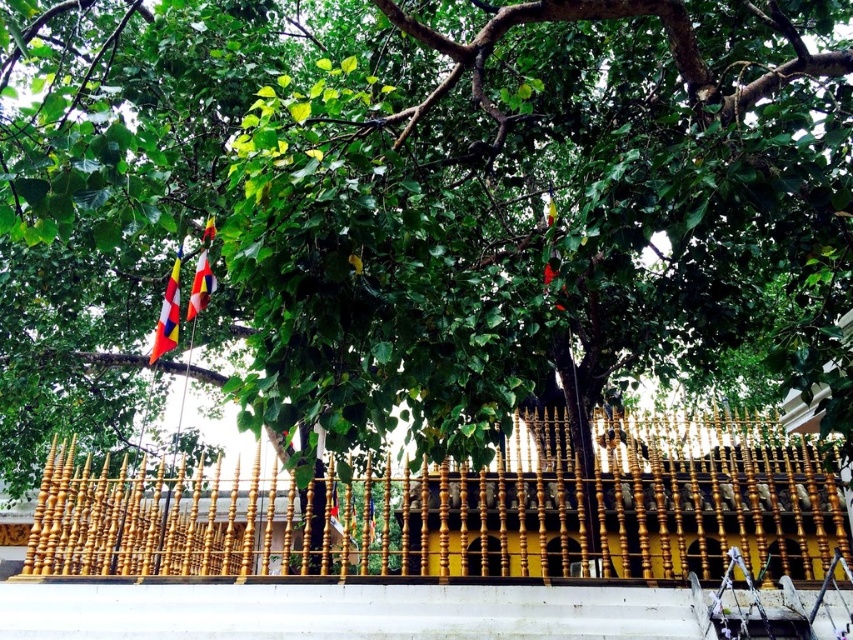
You are standing at the base of the tree and want to place a 10 feet long decorative banner between the gold polished wood fence at center and the multicolored fabric flag at left. Can the banner fit horizontally between them?

The distance between the gold polished wood fence at center and the multicolored fabric flag at left is 7.26 feet. Since the banner is 10 feet long, it cannot fit horizontally between them as the space is smaller than the banner.

You are standing at the center of the image. Which direction should you move to reach the multicolored fabric flag at left?

The multicolored fabric flag at left is located at point (167, 314), so you should move to the left to reach it.